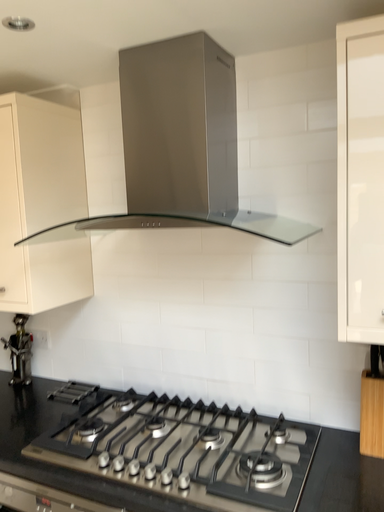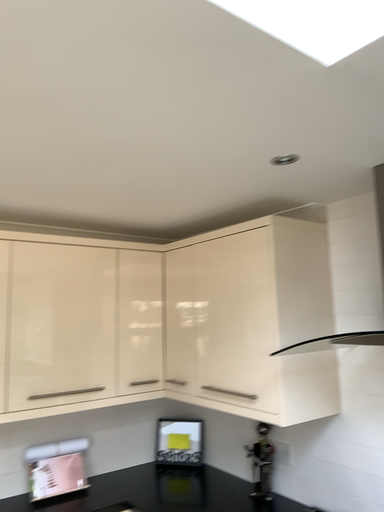
Question: How did the camera likely rotate when shooting the video?

Choices:
 (A) rotated left
 (B) rotated right

Answer: (A)